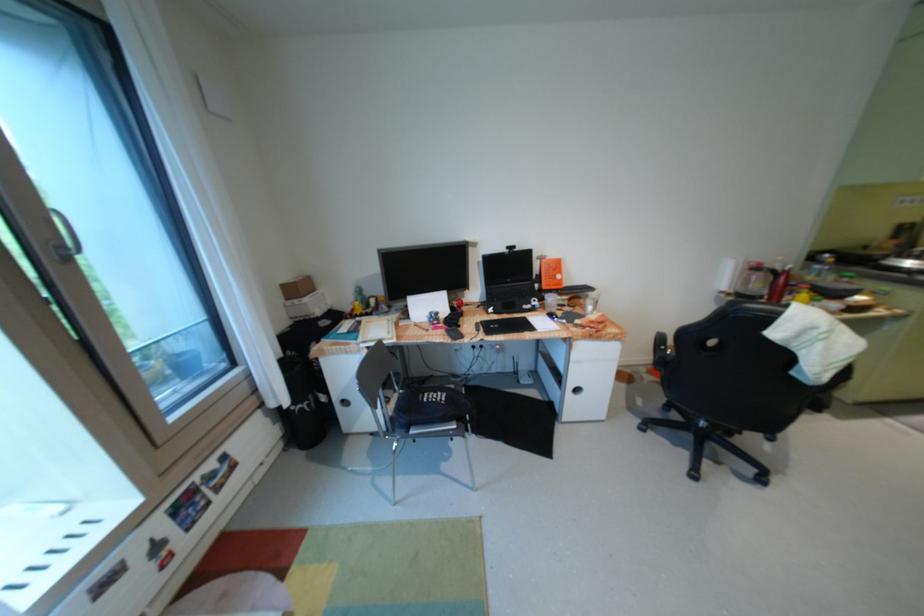
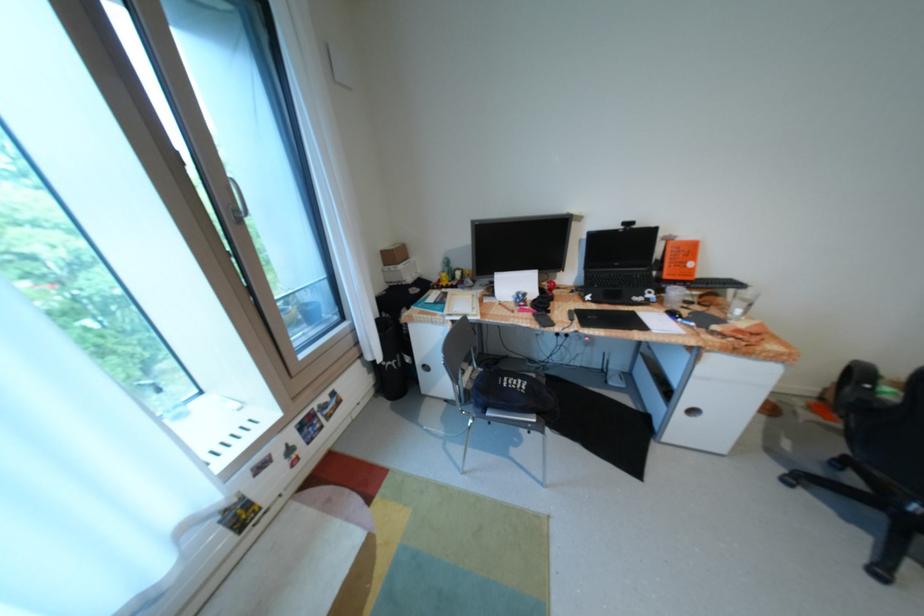
Question: I am providing you with two images of the same scene from different viewpoints. After the viewpoint changes to image2, which objects are now occluded?

Choices:
 (A) white cabinet handle
 (B) small cardboard box
 (C) chair sitting surface
 (D) none of these

Answer: (D)